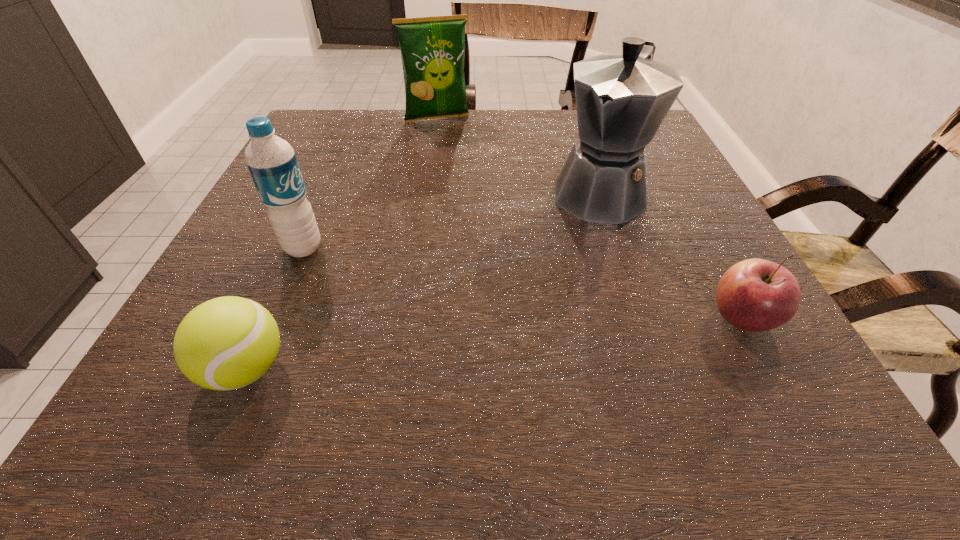
Locate an element on the screen. This screenshot has width=960, height=540. vacant space on the desktop that is between the tennis ball and the rightmost object and is positioned on the label of the water bottle is located at coordinates (553, 338).

Locate an element on the screen. This screenshot has height=540, width=960. free space on the desktop that is between the tennis ball and the rightmost object and is positioned at the spout of the coffeepot is located at coordinates (499, 343).

Find the location of `vacant space on the desktop that is between the tennis ball and the rightmost object and is positioned on the front-facing side of the crisp (potato chip)`. vacant space on the desktop that is between the tennis ball and the rightmost object and is positioned on the front-facing side of the crisp (potato chip) is located at coordinates (528, 340).